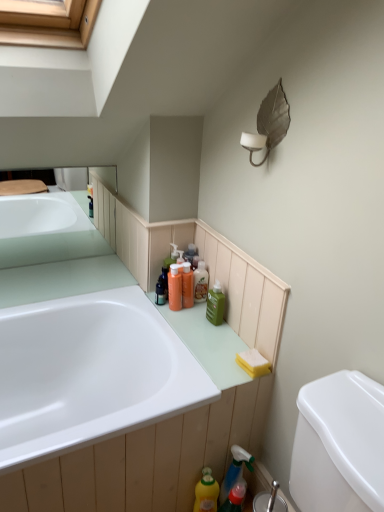
The image size is (384, 512). I want to click on empty space that is in between yellow sponge at lower right and green matte bottle at upper right, the third cleaning product ordered from the bottom, so click(x=231, y=339).